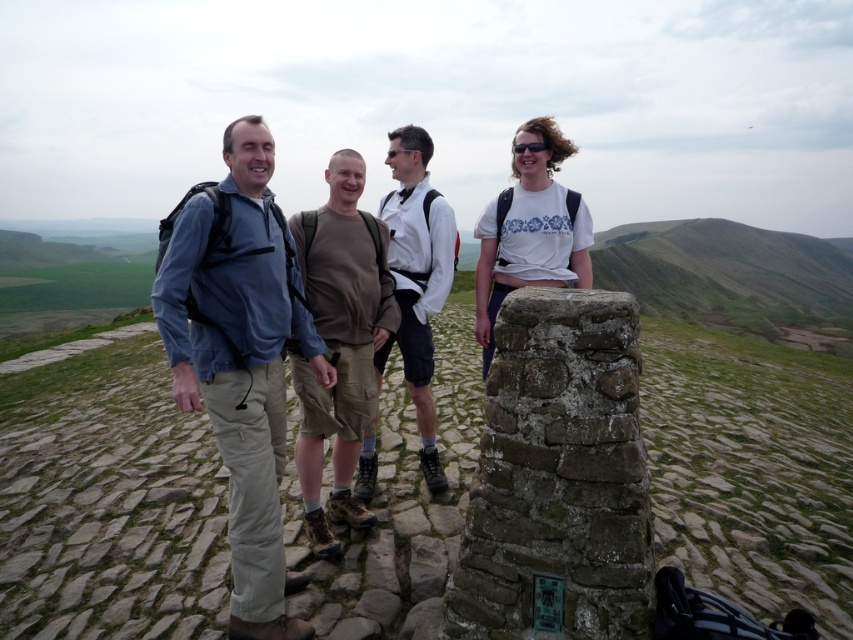
Between matte blue shirt at center and white cotton t-shirt at center, which one appears on the right side from the viewer's perspective?

white cotton t-shirt at center is more to the right.

Can you confirm if matte blue shirt at center is positioned above white cotton t-shirt at center?

No.

The image size is (853, 640). In order to click on matte blue shirt at center in this screenshot , I will do `click(241, 358)`.

Who is lower down, matte blue shirt at center or brown cotton shirt at center?

matte blue shirt at center is below.

Consider the image. Is matte blue shirt at center positioned before brown cotton shirt at center?

Yes, it is in front of brown cotton shirt at center.

Locate an element on the screen. This screenshot has width=853, height=640. matte blue shirt at center is located at coordinates (241, 358).

Between point (491, 355) and point (511, 150), which one is positioned behind?

Positioned behind is point (511, 150).

Between point (546, 128) and point (544, 145), which one is positioned in front?

Positioned in front is point (544, 145).

Where is `white cotton t-shirt at center`? The width and height of the screenshot is (853, 640). white cotton t-shirt at center is located at coordinates (531, 230).